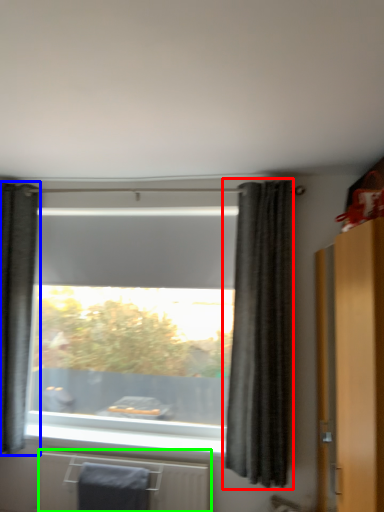
Question: Which object is the closest to the curtain (highlighted by a red box)? Choose among these: curtain (highlighted by a blue box) or radiator (highlighted by a green box).

Choices:
 (A) curtain
 (B) radiator

Answer: (B)